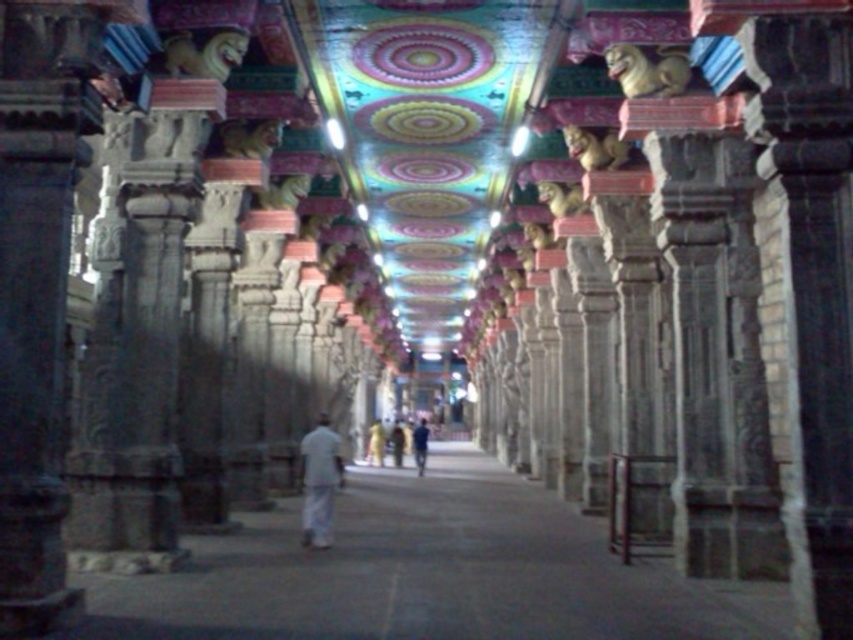
You are standing at the entrance of the corridor and see both the white cotton robe at center and the dark blue fabric at center. Which one is taller?

The dark blue fabric at center is taller than the white cotton robe at center.

You are standing at the entrance of the corridor and see a white cotton robe at center and a dark blue fabric at center. Which one is closer to you?

The white cotton robe at center is closer to you because it is further to the viewer than the dark blue fabric at center.

You are an interior designer planning to install a new chandelier in the corridor. The chandelier you have chosen has a length of 50 feet. You need to ensure that there is enough space between the golden statue at upper center and the dark blue fabric at center to accommodate the chandelier. Is there sufficient space?

The distance between the golden statue at upper center and the dark blue fabric at center is 57.90 feet. Since the chandelier is 50 feet long, there is enough space to install it between them.